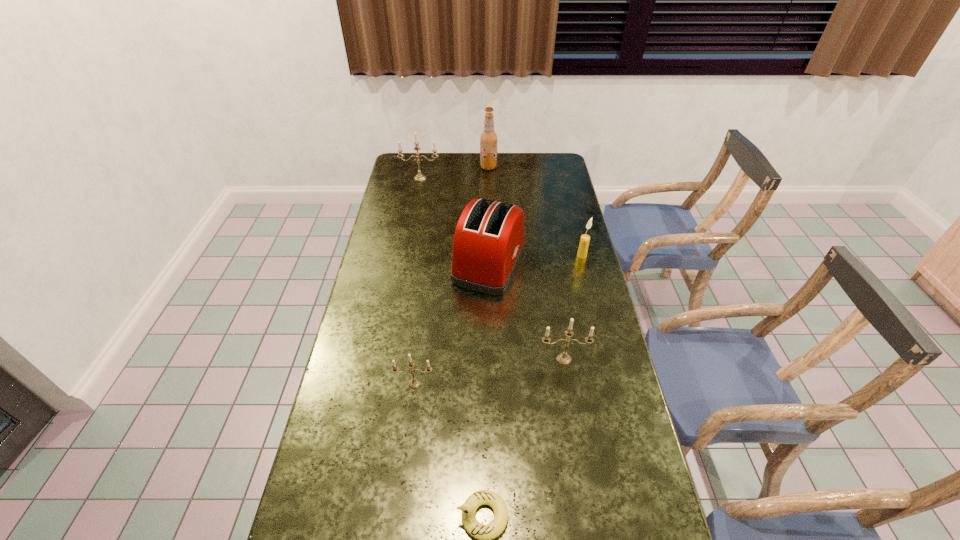
Where is `candle present at the far edge`? candle present at the far edge is located at coordinates (419, 177).

The width and height of the screenshot is (960, 540). I want to click on object that is positioned at the left edge, so click(419, 177).

Locate an element on the screen. The image size is (960, 540). object that is at the far left corner is located at coordinates (419, 177).

Where is `vacant point at the far edge`? The height and width of the screenshot is (540, 960). vacant point at the far edge is located at coordinates (465, 177).

In the image, there is a desktop. Identify the location of vacant space at the left edge. (410, 290).

At what (x,y) coordinates should I click in order to perform the action: click on vacant space at the right edge of the desktop. Please return your answer as a coordinate pair (x, y). The width and height of the screenshot is (960, 540). Looking at the image, I should click on (636, 526).

Image resolution: width=960 pixels, height=540 pixels. What are the coordinates of `vacant position at the far right corner of the desktop` in the screenshot? It's located at (544, 156).

Where is `free spot between the sixth farthest object and the rightmost object`? Image resolution: width=960 pixels, height=540 pixels. free spot between the sixth farthest object and the rightmost object is located at coordinates (498, 320).

Where is `vacant point located between the toaster and the biggest metallic candle`? The width and height of the screenshot is (960, 540). vacant point located between the toaster and the biggest metallic candle is located at coordinates pos(455,221).

At what (x,y) coordinates should I click in order to perform the action: click on vacant area between the second smallest metallic candle and the rightmost object. Please return your answer as a coordinate pair (x, y). This screenshot has height=540, width=960. Looking at the image, I should click on (573, 307).